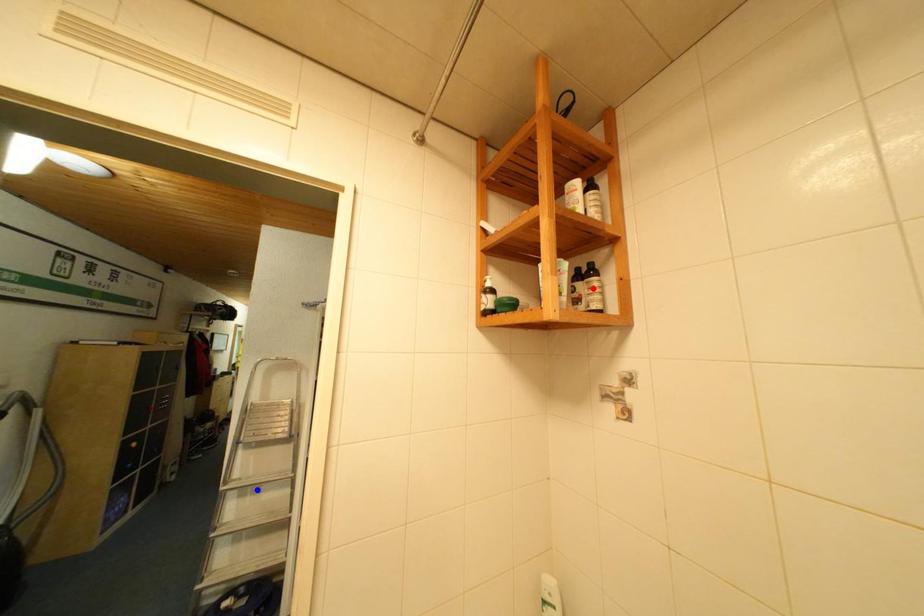
Question: Which of the two points in the image is closer to the camera?

Choices:
 (A) Blue point is closer.
 (B) Red point is closer.

Answer: (B)